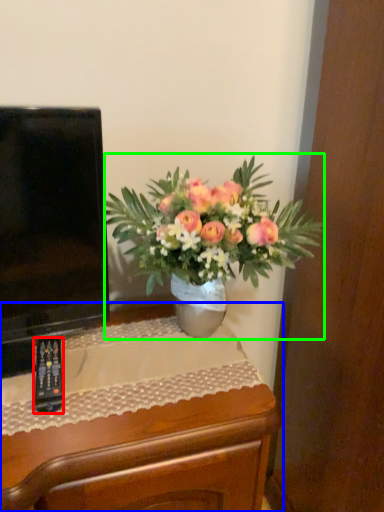
Question: Which is nearer to the remote control (highlighted by a red box)? desk (highlighted by a blue box) or houseplant (highlighted by a green box).

Choices:
 (A) desk
 (B) houseplant

Answer: (A)